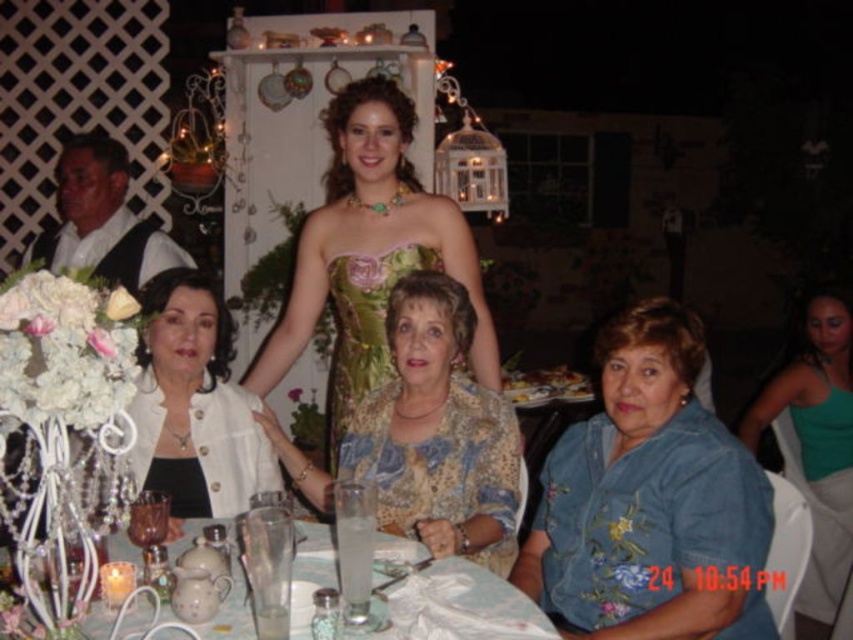
Question: Among these points, which one is farthest from the camera?

Choices:
 (A) (479, 596)
 (B) (457, 392)
 (C) (682, 636)
 (D) (251, 364)

Answer: (D)

Question: Which point is closer to the camera taking this photo?

Choices:
 (A) (555, 448)
 (B) (361, 291)
 (C) (454, 269)

Answer: (A)

Question: From the image, what is the correct spatial relationship of green satin dress at center in relation to white textured blazer at lower left?

Choices:
 (A) above
 (B) below

Answer: (A)

Question: Which of these objects is positioned farthest from the green satin dress at center?

Choices:
 (A) floral-patterned fabric dress at center
 (B) white textured blazer at lower left
 (C) printed silk blouse at center
 (D) teal jersey at right

Answer: (D)

Question: Does green satin dress at center have a lesser width compared to printed silk blouse at center?

Choices:
 (A) yes
 (B) no

Answer: (B)

Question: Can you confirm if teal jersey at right is smaller than translucent glassware at center?

Choices:
 (A) yes
 (B) no

Answer: (B)